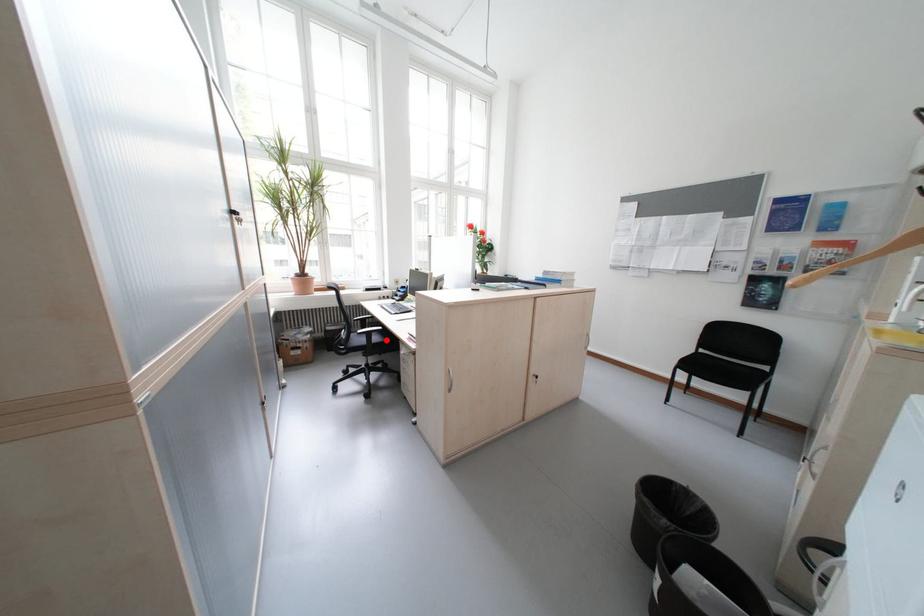
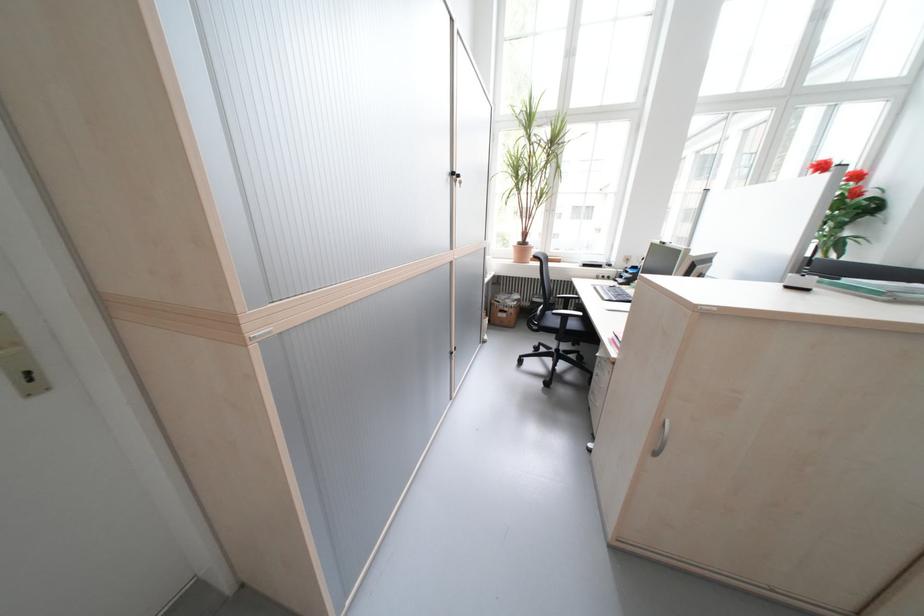
Question: I am providing you with two images of the same scene from different viewpoints. A red point is marked on the first image. Is the red point's position out of view in image 2?

Choices:
 (A) Yes
 (B) No

Answer: (B)